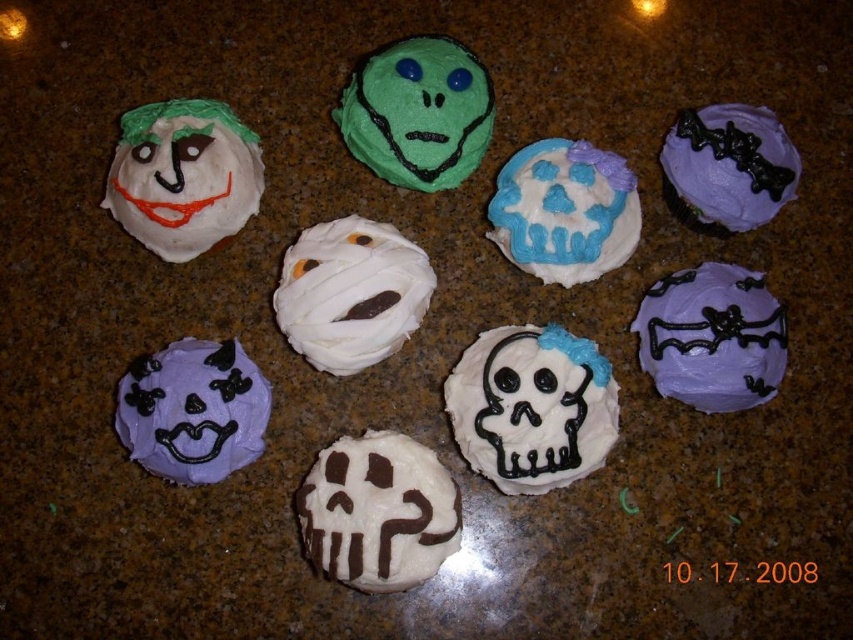
Is point (213, 368) positioned in front of point (579, 257)?

Yes.

Can you confirm if purple matte skull at center is positioned to the right of blue glossy skull at center?

Incorrect, purple matte skull at center is not on the right side of blue glossy skull at center.

The image size is (853, 640). I want to click on purple matte skull at center, so click(192, 410).

Identify the location of purple matte skull at center. (192, 410).

How distant is white chocolate skull at center from matte white cupcake at upper left?

16.77 inches

From the picture: Which is above, white chocolate skull at center or matte white cupcake at upper left?

matte white cupcake at upper left

The width and height of the screenshot is (853, 640). What do you see at coordinates (378, 512) in the screenshot?
I see `white chocolate skull at center` at bounding box center [378, 512].

Where is `white chocolate skull at center`? white chocolate skull at center is located at coordinates (378, 512).

Which of these two, blue glossy skull at center or green matte skull at center, stands shorter?

green matte skull at center is shorter.

At what (x,y) coordinates should I click in order to perform the action: click on blue glossy skull at center. Please return your answer as a coordinate pair (x, y). Looking at the image, I should click on (564, 211).